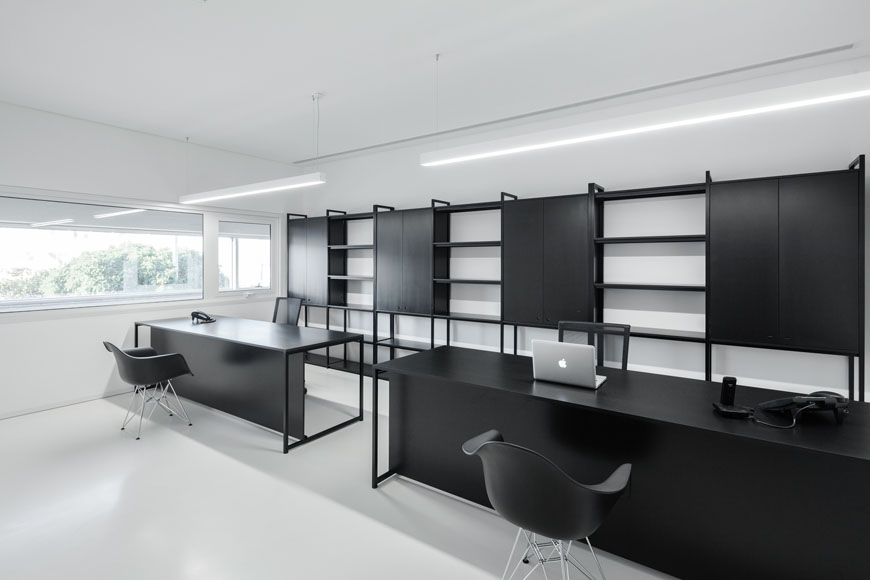
Where is `white wall`? white wall is located at coordinates (58, 387).